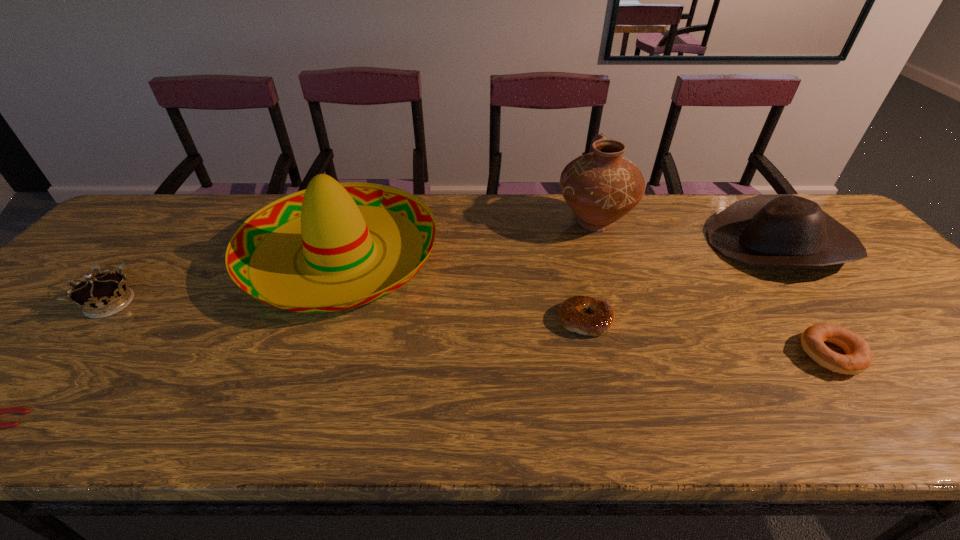
At what (x,y) coordinates should I click in order to perform the action: click on pottery. Please return your answer as a coordinate pair (x, y). Image resolution: width=960 pixels, height=540 pixels. Looking at the image, I should click on (600, 187).

The height and width of the screenshot is (540, 960). Identify the location of the fifth object from right to left. (335, 222).

Identify the location of cowboy hat. (766, 230).

I want to click on crown, so click(101, 295).

At what (x,y) coordinates should I click in order to perform the action: click on the right bagel. Please return your answer as a coordinate pair (x, y). The height and width of the screenshot is (540, 960). Looking at the image, I should click on (858, 357).

The height and width of the screenshot is (540, 960). Find the location of `the left bagel`. the left bagel is located at coordinates (571, 314).

The image size is (960, 540). Identify the location of the shorter bagel. (571, 314).

Image resolution: width=960 pixels, height=540 pixels. Identify the location of free space located 0.230m on the left of the sombrero. (160, 254).

I want to click on vacant space situated 0.150m on the front of the cowboy hat, so click(x=848, y=328).

Locate an element on the screen. This screenshot has height=540, width=960. vacant region located 0.160m on the right of the fourth shortest object is located at coordinates (205, 303).